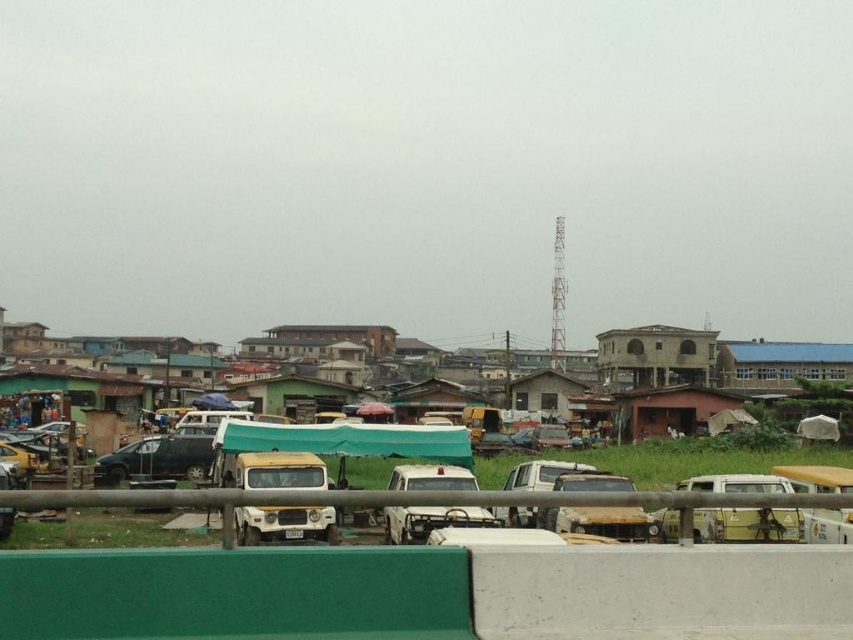
You are a delivery driver who needs to park your vehicle in the parking lot. There is a point marked at coordinates (700, 456) in the image. What object is located at that point?

The point at coordinates (700, 456) corresponds to the yellow matte truck at center.

You are a delivery driver who needs to maneuver your delivery van between the yellow matte truck at center and the matte black car at center. The van is 25 feet long. Can you safely navigate through the space between them without hitting either vehicle?

The distance between the yellow matte truck at center and the matte black car at center is 30.73 feet. Since your van is 25 feet long, there is enough space to safely maneuver between them without collision.